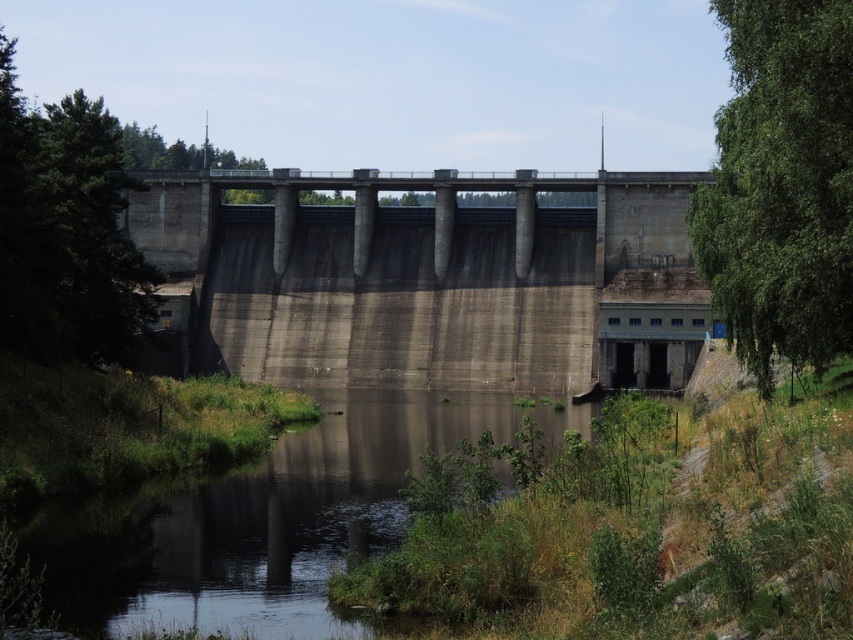
You are a park ranger assessing the safety of the dam. You need to determine if the gray concrete dam at center can support the width of the green leafy tree at right if it were to fall into the water. Can you confirm if the dam is wider than the tree?

The gray concrete dam at center might be wider than green leafy tree at right, so it is possible that the dam can support the width of the tree if it were to fall into the water.

You are a hiker standing on the gray concrete dam at center and you want to cross to the other side. The green leafy tree at left is blocking your path. Can you walk around the tree to reach the other side of the dam?

The gray concrete dam at center is wider than the green leafy tree at left, so you can walk around the tree to reach the other side of the dam.

You are standing on the walkway at the top of the gray concrete dam at center and want to look at the green leafy tree at right. Which direction should you turn your head to see it?

You should turn your head to the right to see the green leafy tree at right since the gray concrete dam at center is to its left.